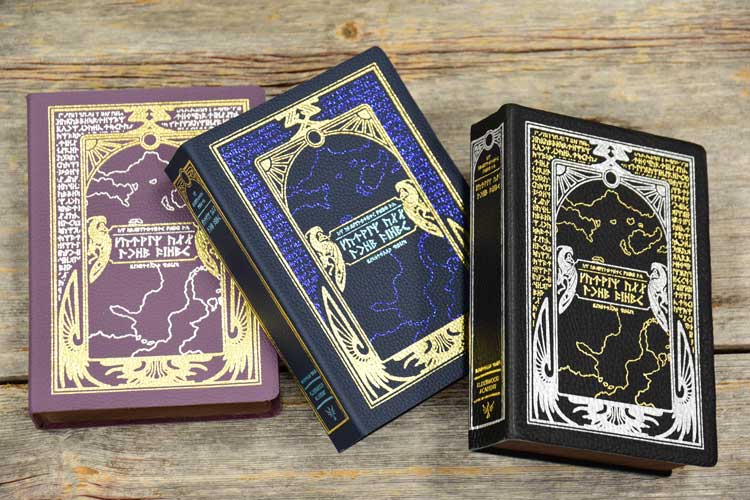
Image resolution: width=750 pixels, height=500 pixels. I want to click on three small books, so [598, 209], [364, 271], [148, 240].